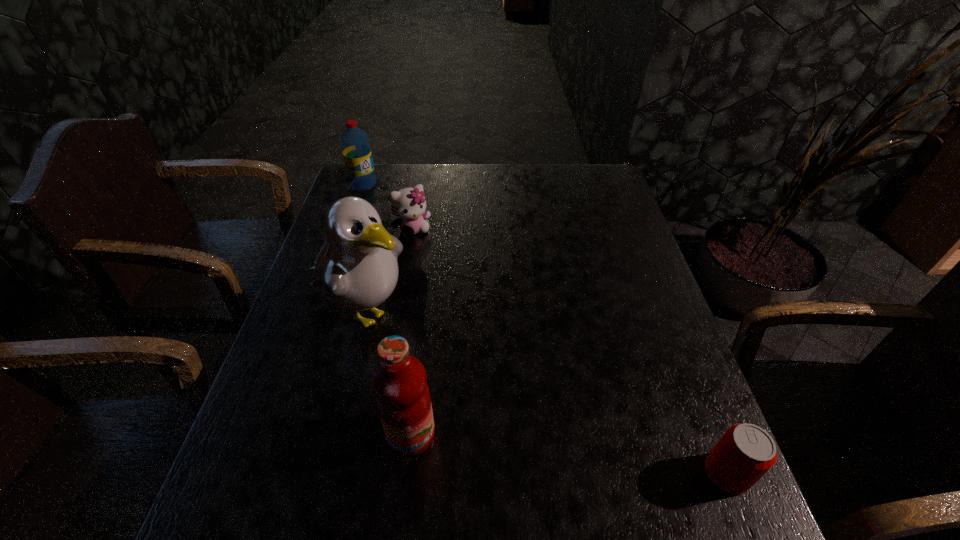
Where is `blank space that satisfies the following two spatial constraints: 1. on the front side of the kitten; 2. on the left side of the beer can`? This screenshot has height=540, width=960. blank space that satisfies the following two spatial constraints: 1. on the front side of the kitten; 2. on the left side of the beer can is located at coordinates (369, 473).

Identify the location of vacant region that satisfies the following two spatial constraints: 1. on the front label of the rightmost object; 2. on the left side of the fruit juice. The width and height of the screenshot is (960, 540). (407, 473).

Identify the location of vacant space that satisfies the following two spatial constraints: 1. on the front label of the beer can; 2. on the left side of the fourth shortest object. (407, 473).

Locate an element on the screen. free space that satisfies the following two spatial constraints: 1. on the front label of the beer can; 2. on the left side of the second tallest object is located at coordinates (x=407, y=473).